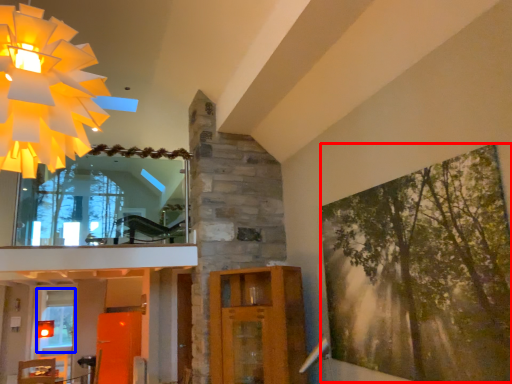
Question: Among these objects, which one is farthest to the camera, tree (highlighted by a red box) or window (highlighted by a blue box)?

Choices:
 (A) tree
 (B) window

Answer: (B)